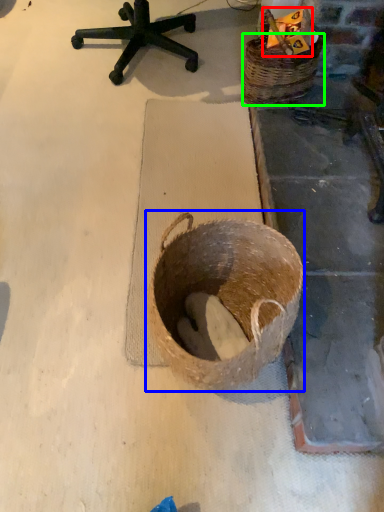
Question: Based on their relative distances, which object is farther from scrap (highlighted by a red box)? Choose from basket (highlighted by a blue box) and basket (highlighted by a green box).

Choices:
 (A) basket
 (B) basket

Answer: (A)